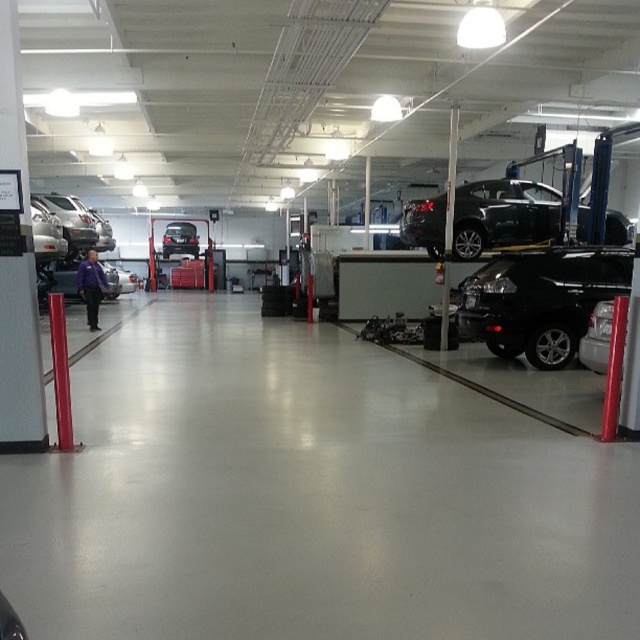
Does black glossy car at right lie in front of shiny silver car at center?

Yes, it is.

Can you confirm if black glossy car at right is positioned below shiny silver car at center?

Indeed, black glossy car at right is positioned under shiny silver car at center.

Based on the photo, measure the distance between black glossy car at right and camera.

29.57 feet

Identify the location of black glossy car at right. The height and width of the screenshot is (640, 640). point(540,300).

Who is shorter, matte black car at left or silver metallic sedan at left?

silver metallic sedan at left

The image size is (640, 640). What do you see at coordinates (64, 278) in the screenshot?
I see `matte black car at left` at bounding box center [64, 278].

Between point (67, 288) and point (58, 225), which one is positioned in front?

Point (58, 225) is in front.

Locate an element on the screen. The image size is (640, 640). matte black car at left is located at coordinates (64, 278).

How distant is satin black car at center from shiny silver car at center?

satin black car at center is 99.83 feet from shiny silver car at center.

Consider the image. Between satin black car at center and shiny silver car at center, which one appears on the left side from the viewer's perspective?

Positioned to the left is shiny silver car at center.

You are a GUI agent. You are given a task and a screenshot of the screen. Output one action in this format:
    pyautogui.click(x=<x>, y=<y>)
    Task: Click on the satin black car at center
    
    Given the screenshot: What is the action you would take?
    pyautogui.click(x=596, y=337)